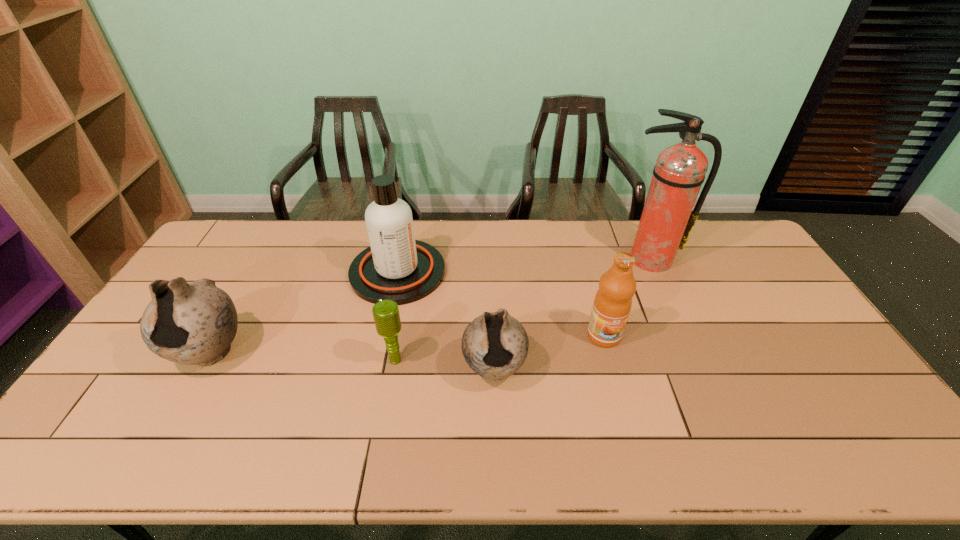
You are a GUI agent. You are given a task and a screenshot of the screen. Output one action in this format:
    pyautogui.click(x=<x>, y=<y>)
    Task: Click on the vacant region at the right edge
    
    Given the screenshot: What is the action you would take?
    pyautogui.click(x=800, y=335)

The image size is (960, 540). In order to click on vacant space at the near left corner of the desktop in this screenshot , I will do `click(97, 414)`.

What are the coordinates of `free space at the near right corner of the desktop` in the screenshot? It's located at (804, 396).

This screenshot has width=960, height=540. I want to click on empty location between the right pottery and the fire extinguisher, so click(x=571, y=314).

The height and width of the screenshot is (540, 960). Find the location of `vacant point located between the leftmost object and the fruit juice`. vacant point located between the leftmost object and the fruit juice is located at coordinates (407, 344).

This screenshot has height=540, width=960. I want to click on free spot between the rightmost object and the second tallest object, so click(523, 266).

The width and height of the screenshot is (960, 540). I want to click on free space between the second tallest object and the rightmost object, so click(523, 266).

Identify the location of free space between the fifth shortest object and the left pottery. Image resolution: width=960 pixels, height=540 pixels. tap(304, 312).

Identify the location of vacant space that's between the second object from right to left and the second tallest object. (501, 304).

Find the location of a particular element. free space between the fruit juice and the shorter pottery is located at coordinates (549, 352).